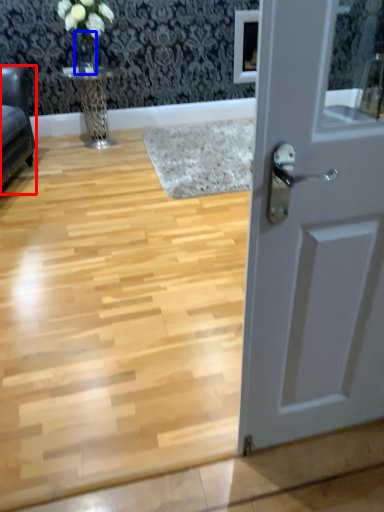
Question: Which of the following is the farthest to the observer, furniture (highlighted by a red box) or glass vase (highlighted by a blue box)?

Choices:
 (A) furniture
 (B) glass vase

Answer: (B)